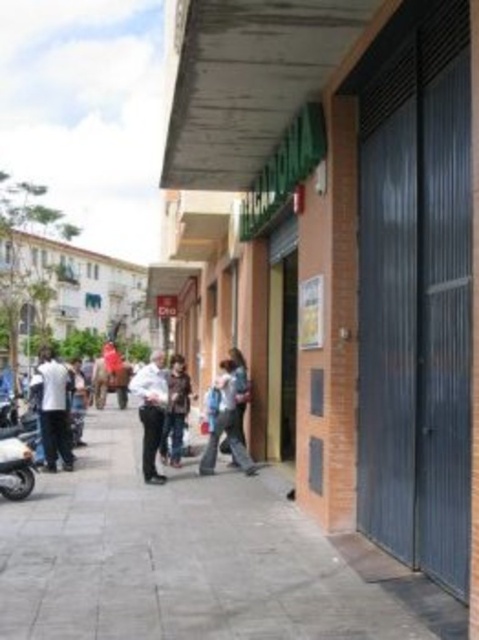
You are a delivery person carrying a large package that is 1.5 meters wide. You need to walk through the street scene shown in the image. Can your package fit between the gray concrete pavement at center and the dark brown leather jacket at center without touching either?

The gray concrete pavement at center is wider than the dark brown leather jacket at center. Since your package is 1.5 meters wide, it depends on the actual width of the space between them. However, the description only states the pavement is wider, not the exact measurement. Without specific dimensions, it is uncertain if the package will fit without touching either object.

You are standing on the sidewalk in the street scene and notice a gray concrete pavement at center and a dark brown leather jacket at center. Which object is positioned to the right of the other?

The gray concrete pavement at center is to the right of dark brown leather jacket at center.

You are a delivery person trying to park your shiny metallic motorcycle at lower left next to the dark brown leather jacket at center on the sidewalk. Considering their sizes, will the motorcycle fit without overlapping the jacket?

The shiny metallic motorcycle at lower left is wider than the dark brown leather jacket at center, so it can fit next to it without overlapping as long as there is enough space on the sidewalk.